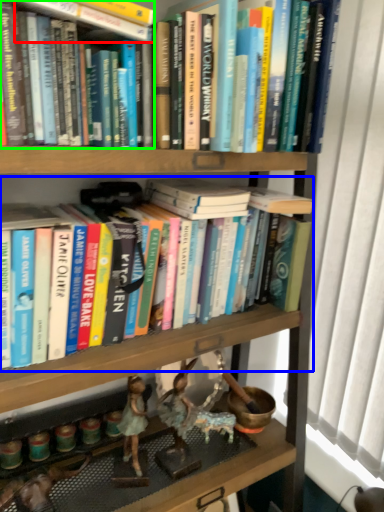
Question: Estimate the real-world distances between objects in this image. Which object is closer to book (highlighted by a red box), book (highlighted by a blue box) or book (highlighted by a green box)?

Choices:
 (A) book
 (B) book

Answer: (B)